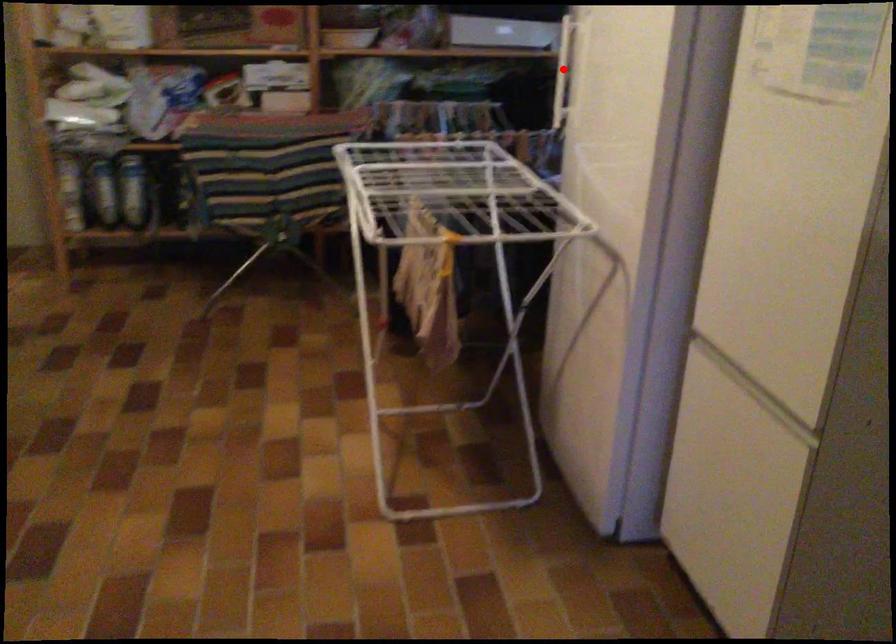
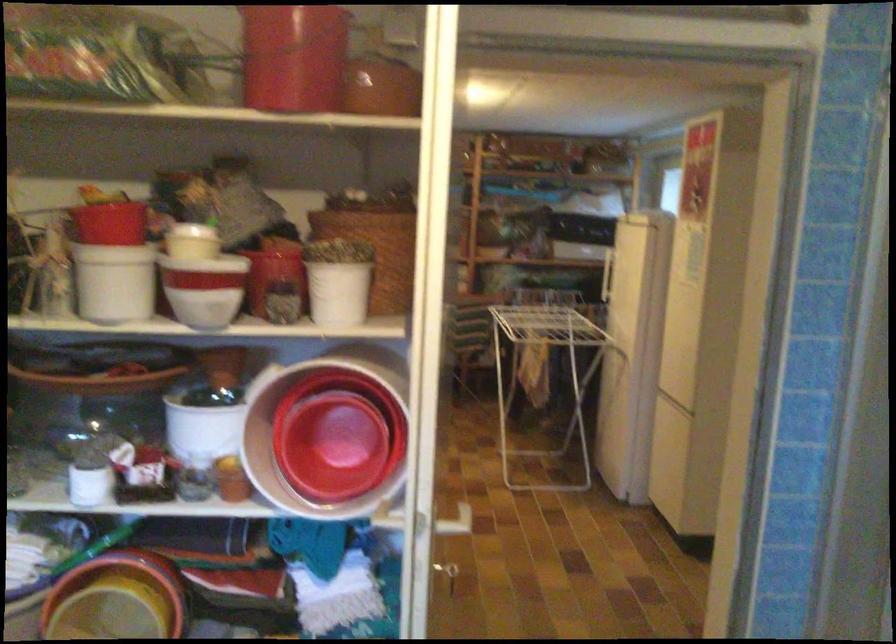
Question: I am providing you with two images of the same scene from different viewpoints. A red point is marked on the first image. At the location where the point appears in image 1, is it still visible in image 2?

Choices:
 (A) Yes
 (B) No

Answer: (B)